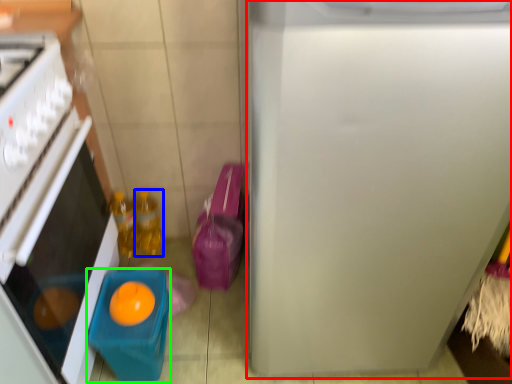
Question: Which is farther away from refrigerator (highlighted by a red box)? bottle (highlighted by a blue box) or toy (highlighted by a green box)?

Choices:
 (A) bottle
 (B) toy

Answer: (A)